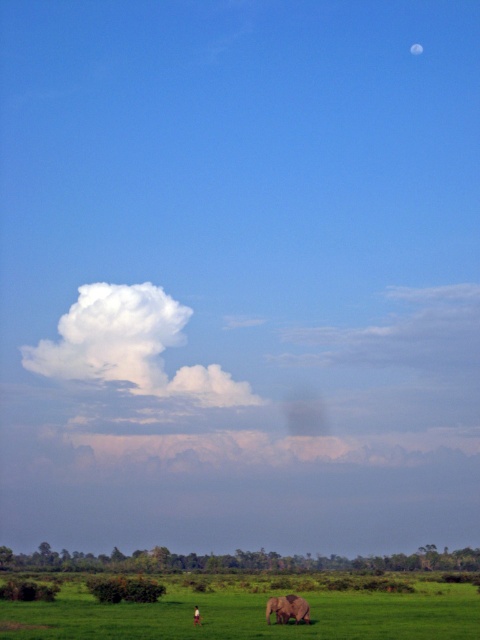
You are an airplane pilot preparing for takeoff. You see the white fluffy cloud at upper center and the gray matte elephant at lower center in your view. Which object is higher in the sky?

The white fluffy cloud at upper center is higher in the sky than the gray matte elephant at lower center because it is located above it.

You are a photographer trying to capture the gray matte elephant at lower center and the white fluffy cloud at upper center in the same frame. Based on their positions, which object is positioned to the left of the other?

The white fluffy cloud at upper center is positioned to the left of the gray matte elephant at lower center.